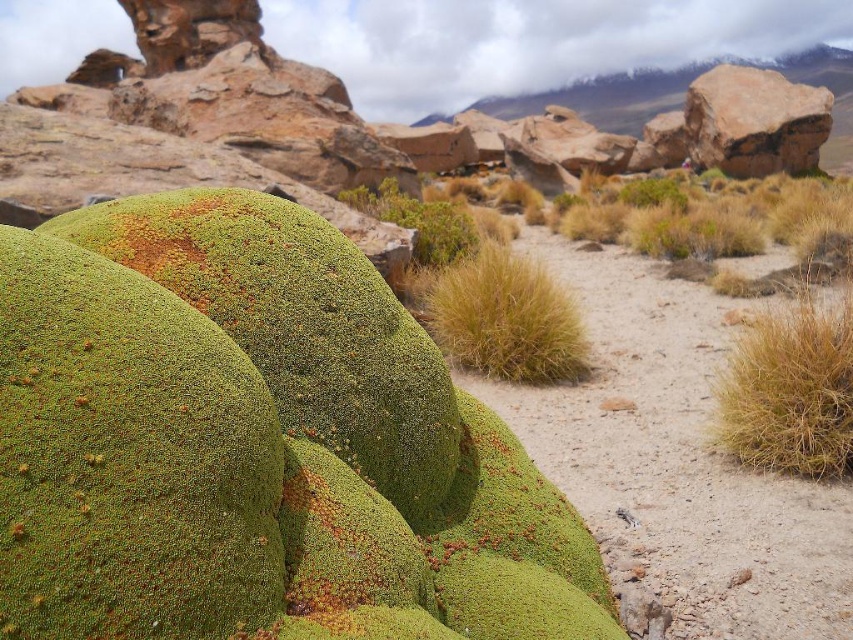
Is point (798, 413) farther from viewer compared to point (496, 243)?

No, it is not.

Is dry straw-like grass at right shorter than dry grass at center?

Indeed, dry straw-like grass at right has a lesser height compared to dry grass at center.

What do you see at coordinates (790, 388) in the screenshot? I see `dry straw-like grass at right` at bounding box center [790, 388].

Image resolution: width=853 pixels, height=640 pixels. Identify the location of dry straw-like grass at right. (790, 388).